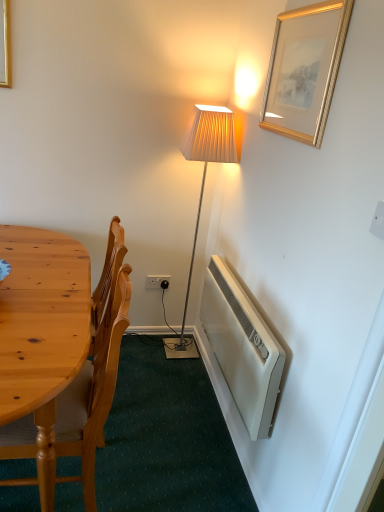
Identify the location of vacant area situated below white plastic radiator at lower right (from a real-world perspective). (221, 421).